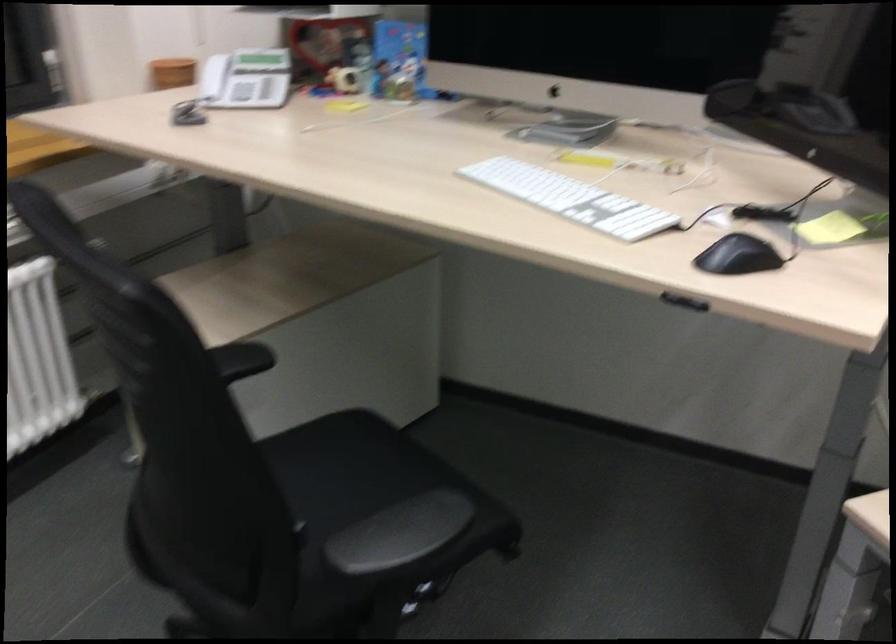
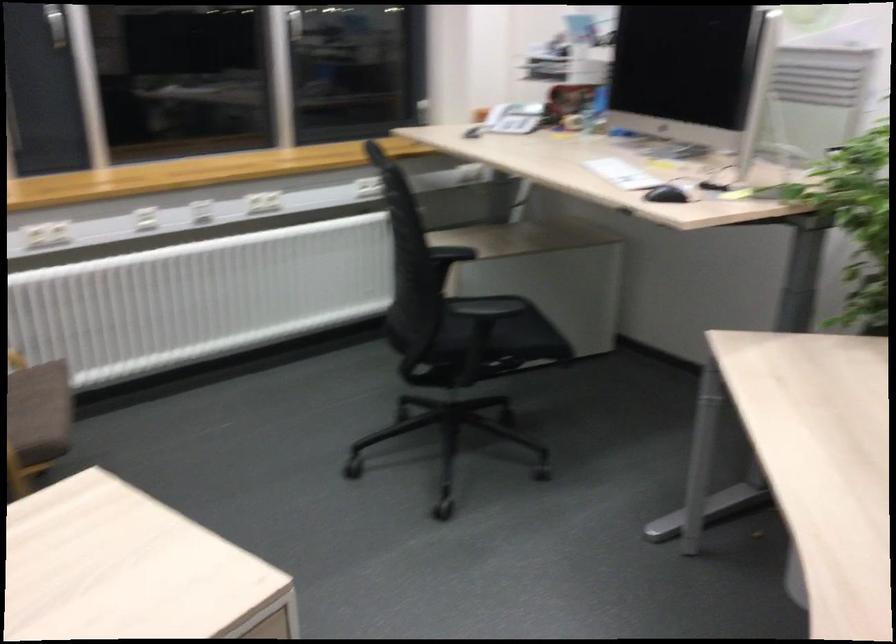
Where in the second image is the point corresponding to point (560, 204) from the first image?

(622, 174)